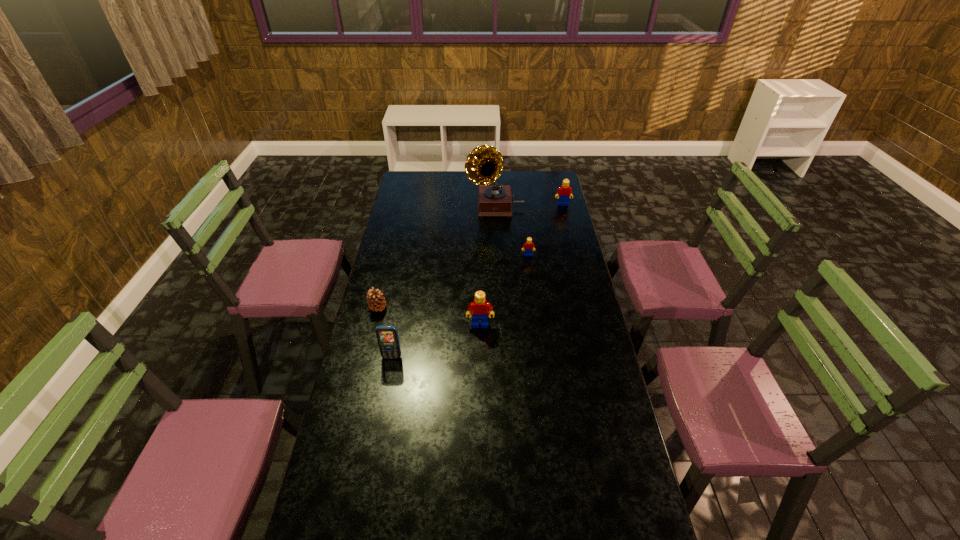
Identify the location of empty location between the leftmost Lego and the cellular telephone. (436, 341).

Locate an element on the screen. free spot between the nearest Lego and the farthest Lego is located at coordinates (521, 265).

You are a GUI agent. You are given a task and a screenshot of the screen. Output one action in this format:
    pyautogui.click(x=<x>, y=<y>)
    Task: Click on the empty space that is in between the third nearest object and the phonograph record
    Image resolution: width=960 pixels, height=540 pixels.
    Given the screenshot: What is the action you would take?
    pyautogui.click(x=437, y=258)

Identify the location of vacant area between the cellular telephone and the second Lego from left to right. This screenshot has width=960, height=540. (460, 306).

This screenshot has height=540, width=960. Find the location of `blank region between the second tallest Lego and the cellular telephone`. blank region between the second tallest Lego and the cellular telephone is located at coordinates (477, 281).

Locate an element on the screen. empty space between the shortest Lego and the nearest Lego is located at coordinates (504, 290).

You are a GUI agent. You are given a task and a screenshot of the screen. Output one action in this format:
    pyautogui.click(x=<x>, y=<y>)
    Task: Click on the unoccupied position between the second tallest Lego and the cellular telephone
    This screenshot has width=960, height=540.
    Given the screenshot: What is the action you would take?
    pyautogui.click(x=477, y=281)

Select which object appears as the closest to the third farthest object. Please provide its 2D coordinates. Your answer should be formatted as a tuple, i.e. [(x, y)], where the tuple contains the x and y coordinates of a point satisfying the conditions above.

[(484, 164)]

Select which object appears as the second closest to the nearest object. Please provide its 2D coordinates. Your answer should be formatted as a tuple, i.e. [(x, y)], where the tuple contains the x and y coordinates of a point satisfying the conditions above.

[(479, 307)]

Identify which Lego is the second nearest to the leftmost Lego. Please provide its 2D coordinates. Your answer should be formatted as a tuple, i.e. [(x, y)], where the tuple contains the x and y coordinates of a point satisfying the conditions above.

[(564, 192)]